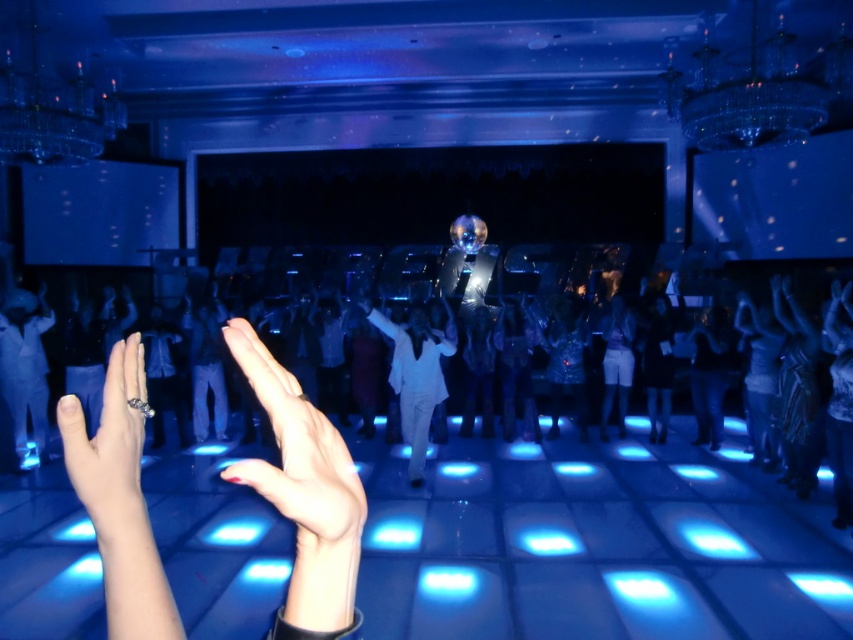
Is point (128, 358) positioned in front of point (405, 396)?

That is True.

Between silver metallic ring at lower left and white glossy suit at center, which one appears on the right side from the viewer's perspective?

white glossy suit at center

Who is more distant from viewer, (137, 460) or (397, 355)?

Point (397, 355)

Identify the location of silver metallic ring at lower left. The width and height of the screenshot is (853, 640). (109, 444).

Between point (306, 413) and point (131, 468), which one is positioned in front?

Positioned in front is point (306, 413).

What do you see at coordinates (297, 452) in the screenshot? I see `nail polish at center` at bounding box center [297, 452].

Where is `nail polish at center`? The width and height of the screenshot is (853, 640). nail polish at center is located at coordinates (297, 452).

Can you confirm if silver metallic ring at lower left is positioned above matte white dress at lower left?

Indeed, silver metallic ring at lower left is positioned over matte white dress at lower left.

Which is in front, point (131, 497) or point (6, 314)?

Point (131, 497) is in front.

Is point (90, 515) positioned behind point (1, 332)?

No, it is in front of (1, 332).

Where is `silver metallic ring at lower left`? silver metallic ring at lower left is located at coordinates (109, 444).